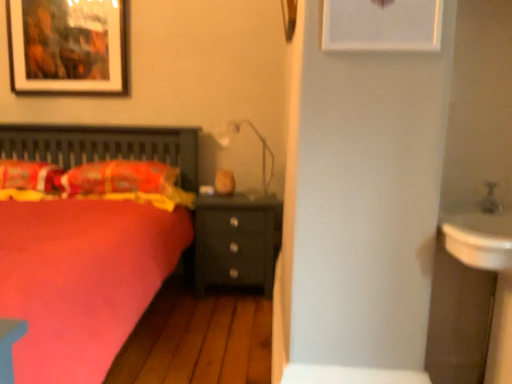
Question: Is matte black picture frame at upper left, the 1th picture frame from the back, inside or outside of fluffy orange pillow at left, which is the second pillow in right-to-left order?

Choices:
 (A) outside
 (B) inside

Answer: (A)

Question: Is point (55, 29) closer or farther from the camera than point (33, 175)?

Choices:
 (A) closer
 (B) farther

Answer: (B)

Question: Which of these objects is positioned farthest from the matte black picture frame at upper left, acting as the 1th picture frame starting from the left?

Choices:
 (A) white matte picture frame at upper center, placed as the first picture frame when sorted from front to back
 (B) fluffy orange pillow at left, the 2th pillow in the left-to-right sequence
 (C) matte white lamp at center
 (D) white glossy sink at right
 (E) matte black nightstand at center

Answer: (D)

Question: Which object is positioned farthest from the matte black picture frame at upper left, the 1th picture frame from the back?

Choices:
 (A) matte black nightstand at center
 (B) fluffy orange pillow at left, which is the second pillow in right-to-left order
 (C) white glossy sink at right
 (D) white matte picture frame at upper center, which is the 1th picture frame in right-to-left order
 (E) matte white lamp at center

Answer: (C)